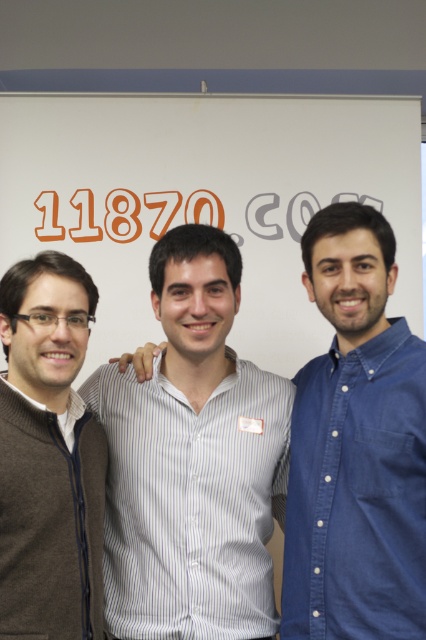
Question: Does white striped shirt at center have a lesser width compared to blue denim shirt at right?

Choices:
 (A) yes
 (B) no

Answer: (B)

Question: Among these objects, which one is farthest from the camera?

Choices:
 (A) brown sweater at left
 (B) white matte board at center
 (C) blue denim shirt at right

Answer: (B)

Question: Based on their relative distances, which object is nearer to the brown sweater at left?

Choices:
 (A) white matte board at center
 (B) white striped shirt at center

Answer: (B)

Question: Which point is closer to the camera taking this photo?

Choices:
 (A) (63, 285)
 (B) (368, 461)
 (C) (195, 440)

Answer: (B)

Question: Can you confirm if white striped shirt at center is positioned above brown sweater at left?

Choices:
 (A) no
 (B) yes

Answer: (B)

Question: Does white matte board at center appear on the right side of blue denim shirt at right?

Choices:
 (A) yes
 (B) no

Answer: (B)